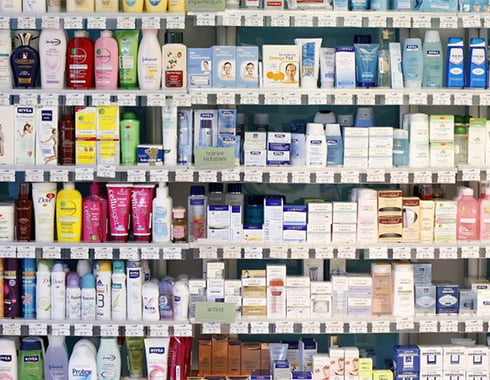
Identify the location of gold bottle stopper. [22, 40], [389, 35].